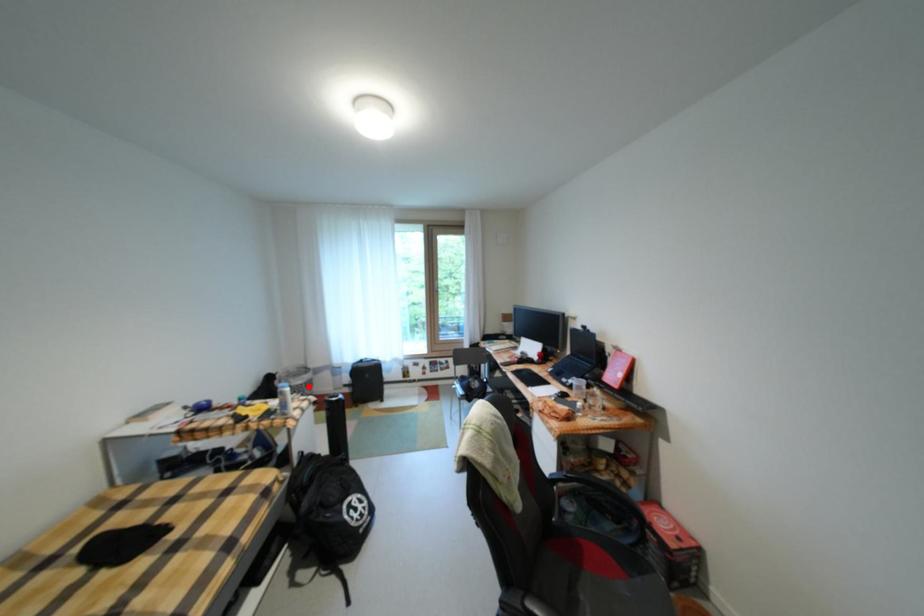
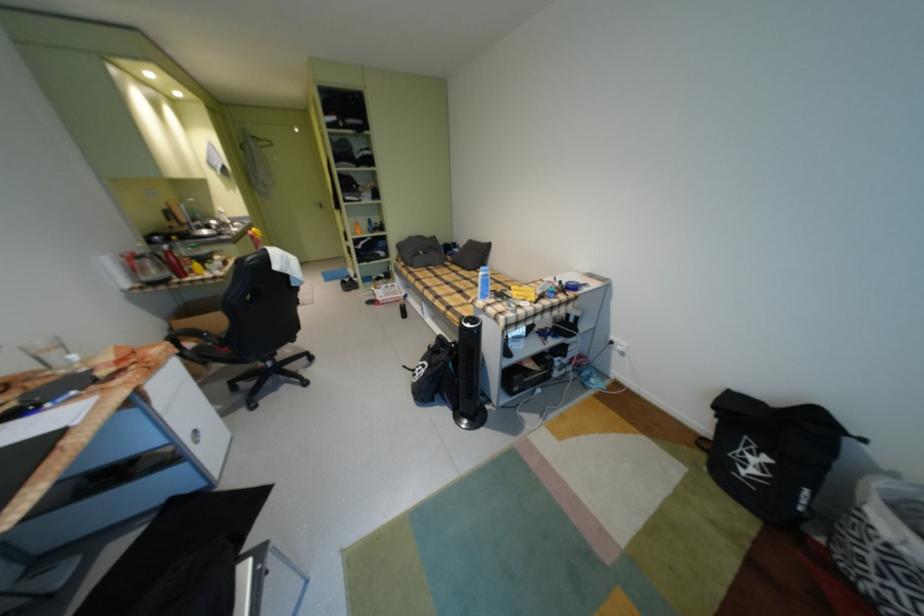
Find the pixel in the second image that matches the highlighted location in the first image.

(882, 529)